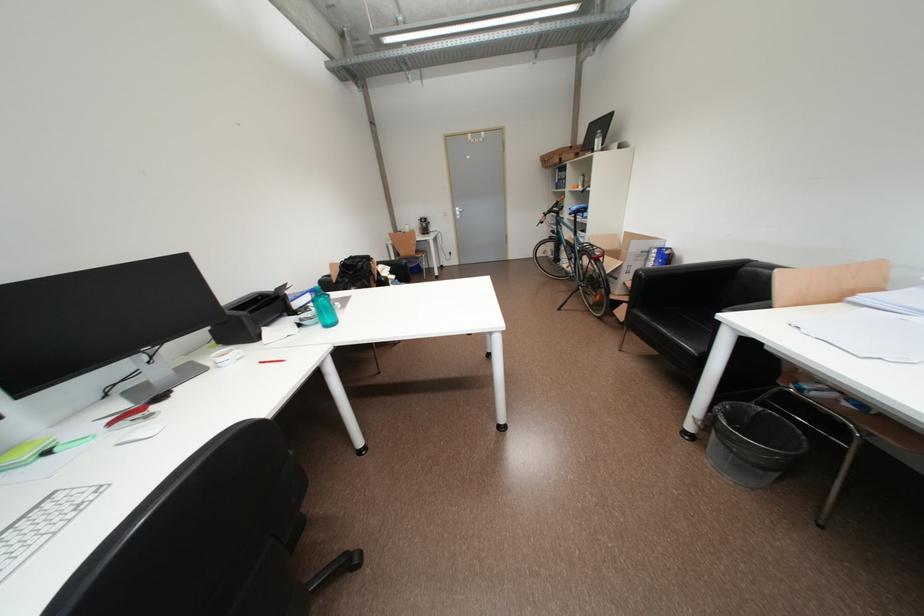
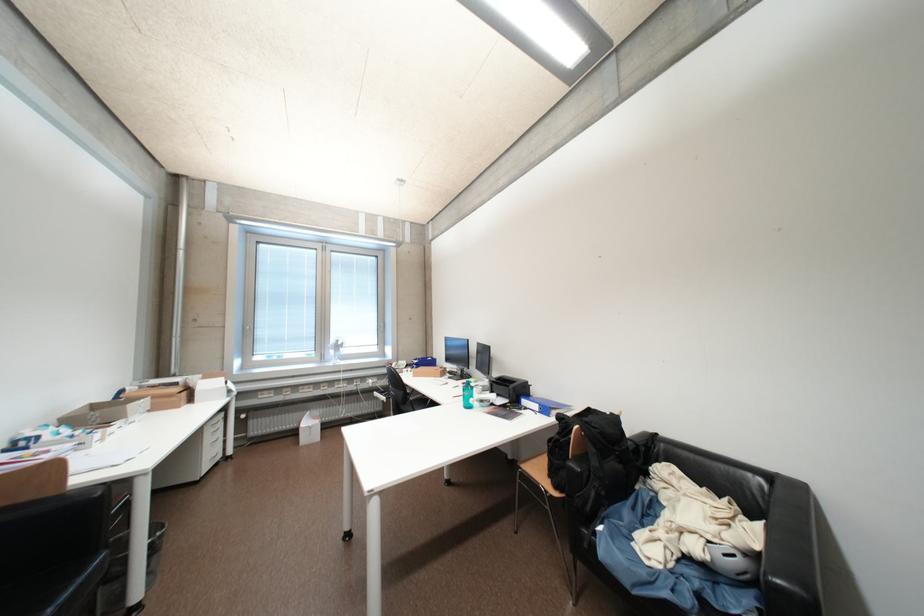
In the second image, find the point that corresponds to point (400, 278) in the first image.

(704, 551)